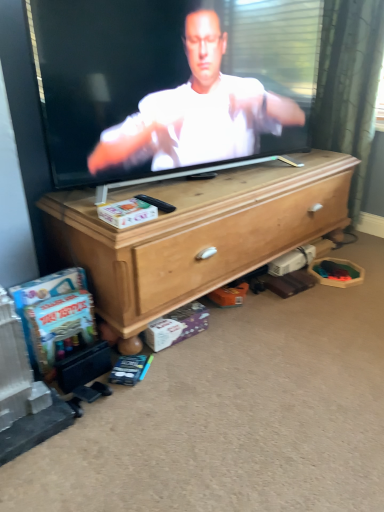
Locate an element on the screen. This screenshot has height=512, width=384. vacant area situated to the left side of black plastic remote control at center is located at coordinates (94, 204).